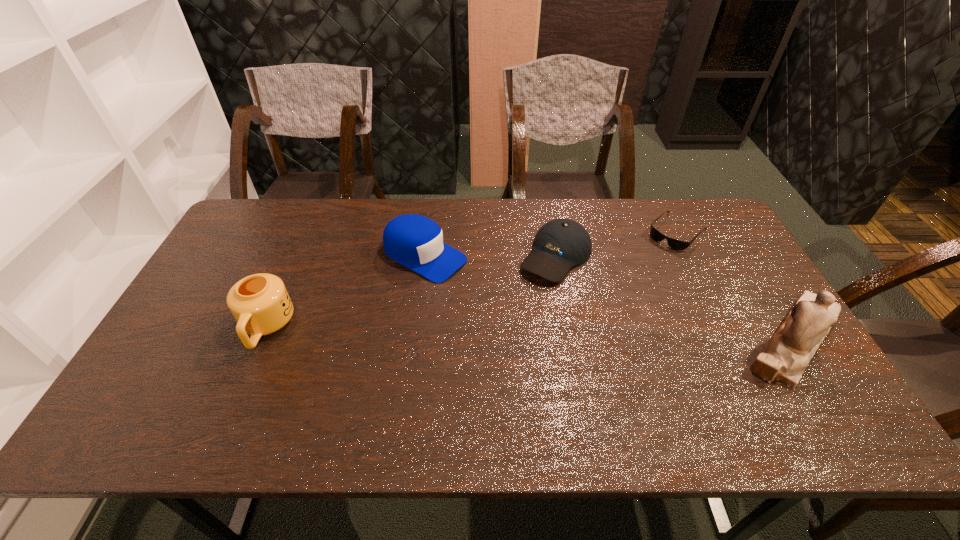
Locate an element on the screen. vacant space located on the front-facing side of the sunglasses is located at coordinates (646, 263).

This screenshot has height=540, width=960. I want to click on vacant area situated 0.340m on the front-facing side of the sunglasses, so click(606, 303).

Where is `vacant region located 0.200m on the front-facing side of the right baseball cap`? The height and width of the screenshot is (540, 960). vacant region located 0.200m on the front-facing side of the right baseball cap is located at coordinates (505, 326).

Locate an element on the screen. This screenshot has height=540, width=960. free space located 0.210m on the front-facing side of the right baseball cap is located at coordinates (503, 328).

Where is `free space located on the front-facing side of the right baseball cap`? free space located on the front-facing side of the right baseball cap is located at coordinates (471, 368).

I want to click on vacant space situated on the front-facing side of the taller baseball cap, so click(x=474, y=280).

Find the location of a particular element. vacant space situated on the front-facing side of the taller baseball cap is located at coordinates (577, 335).

The height and width of the screenshot is (540, 960). I want to click on blank space located 0.240m on the front-facing side of the taller baseball cap, so click(525, 307).

Where is `sunglasses that is at the far edge`? sunglasses that is at the far edge is located at coordinates pos(676,244).

Locate an element on the screen. The image size is (960, 540). object present at the near edge is located at coordinates (785, 358).